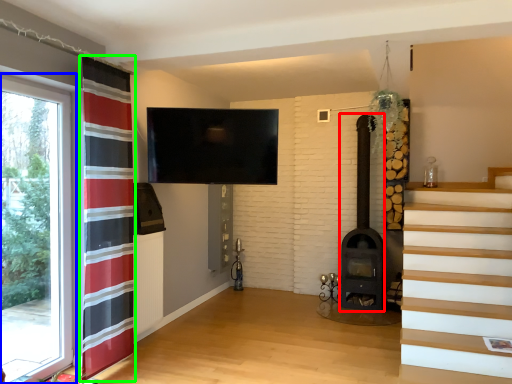
Question: Which object is positioned closest to fireplace (highlighted by a red box)? Select from window (highlighted by a blue box) and curtain (highlighted by a green box).

Choices:
 (A) window
 (B) curtain

Answer: (B)